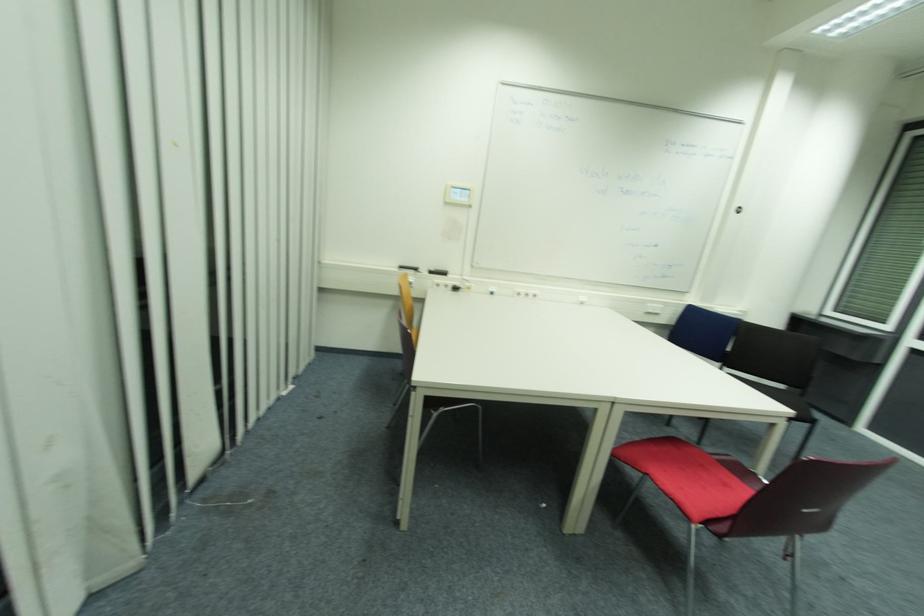
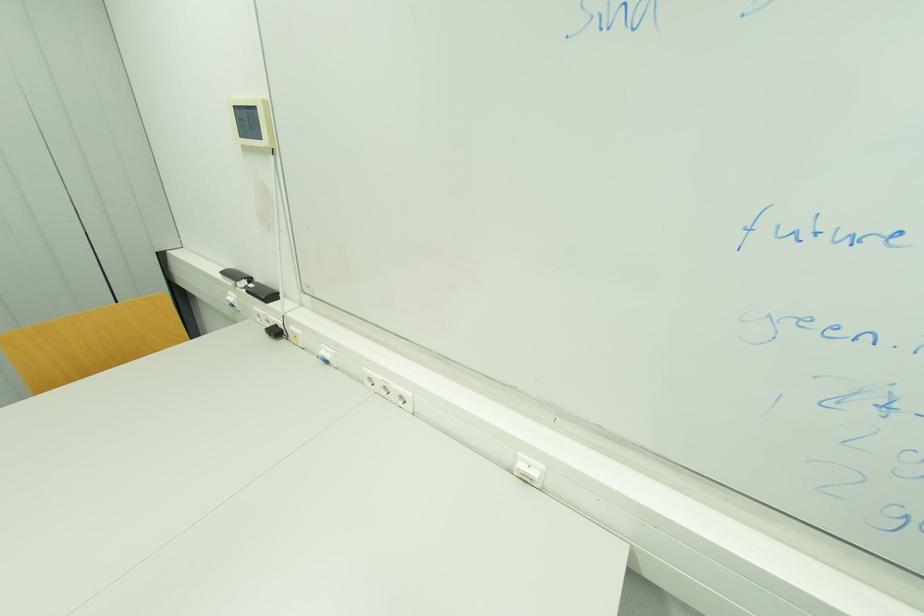
The point at (458, 290) is marked in the first image. Where is the corresponding point in the second image?

(281, 333)